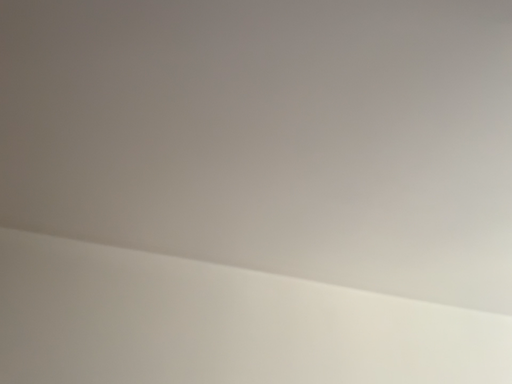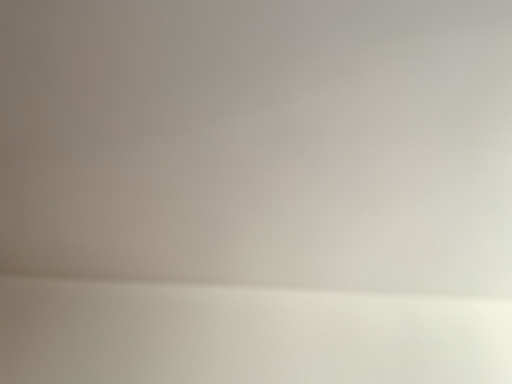
Question: How did the camera likely rotate when shooting the video?

Choices:
 (A) rotated right
 (B) rotated left

Answer: (B)